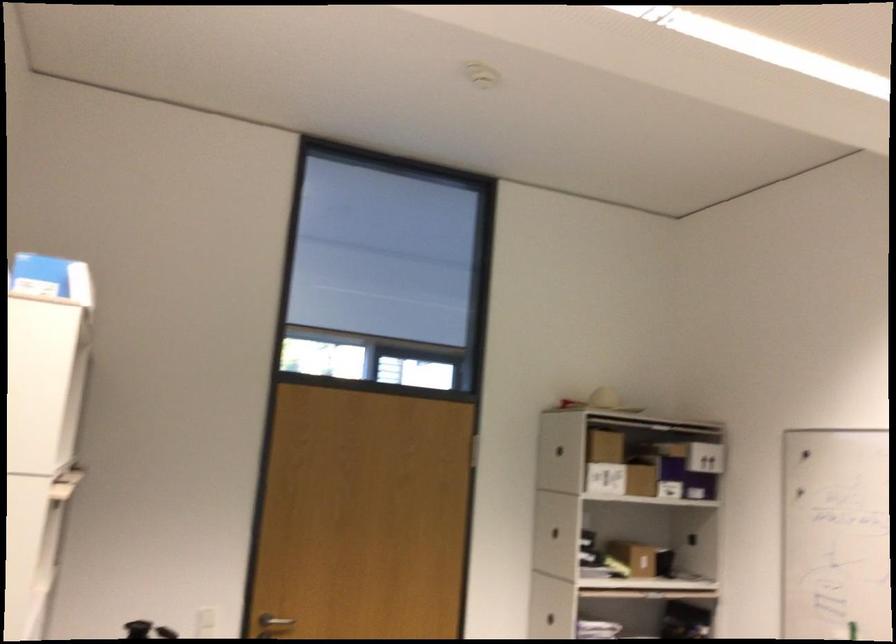
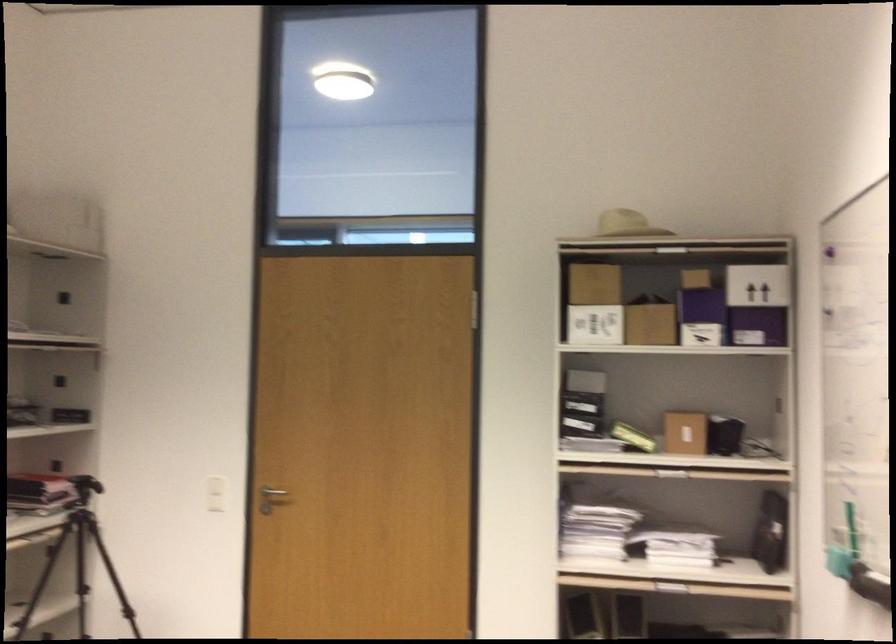
In the second image, find the point that corresponds to (x=632, y=564) in the first image.

(684, 431)